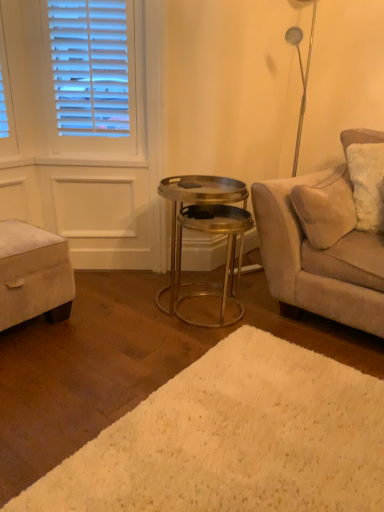
Describe the element at coordinates (32, 272) in the screenshot. I see `velvet beige ottoman at lower left` at that location.

Find the location of `suede beige couch at right`. suede beige couch at right is located at coordinates (319, 250).

What is the approximate height of white shag rug at lower center?

white shag rug at lower center is 1.61 inches tall.

Locate an element on the screen. The image size is (384, 512). velvet beige ottoman at lower left is located at coordinates (32, 272).

From a real-world perspective, relative to metallic/golden table at center, is white shag rug at lower center vertically above or below?

In terms of real-world spatial position, white shag rug at lower center is below metallic/golden table at center.

Which of these two, white shag rug at lower center or metallic/golden table at center, is smaller?

Smaller between the two is white shag rug at lower center.

Who is taller, white shag rug at lower center or metallic/golden table at center?

metallic/golden table at center.

Is white shag rug at lower center positioned with its back to metallic/golden table at center?

white shag rug at lower center is not turned away from metallic/golden table at center.

Is white shag rug at lower center at the right side of suede beige couch at right?

In fact, white shag rug at lower center is to the left of suede beige couch at right.

The width and height of the screenshot is (384, 512). I want to click on studio couch lying above the white shag rug at lower center (from the image's perspective), so click(x=319, y=250).

What's the angular difference between white shag rug at lower center and suede beige couch at right's facing directions?

179 degrees separate the facing orientations of white shag rug at lower center and suede beige couch at right.

Looking at the image, does white shag rug at lower center seem bigger or smaller compared to suede beige couch at right?

In the image, white shag rug at lower center appears to be smaller than suede beige couch at right.

Is metallic/golden table at center beside white shag rug at lower center?

metallic/golden table at center and white shag rug at lower center are not in contact.

Who is smaller, metallic/golden table at center or white shag rug at lower center?

white shag rug at lower center.

From the image's perspective, would you say metallic/golden table at center is shown under white shag rug at lower center?

No, from the image's perspective, metallic/golden table at center is not below white shag rug at lower center.

Could you tell me if metallic/golden table at center is facing white shag rug at lower center?

No, metallic/golden table at center does not turn towards white shag rug at lower center.

Is metallic/golden table at center not close to suede beige couch at right?

No, metallic/golden table at center is not far from suede beige couch at right.

Is metallic/golden table at center taller or shorter than suede beige couch at right?

metallic/golden table at center is shorter than suede beige couch at right.

Considering the relative positions of metallic/golden table at center and suede beige couch at right in the image provided, is metallic/golden table at center to the right of suede beige couch at right from the viewer's perspective?

No, metallic/golden table at center is not to the right of suede beige couch at right.

From a real-world perspective, who is located higher, metallic/golden table at center or suede beige couch at right?

suede beige couch at right is physically above.

You are a GUI agent. You are given a task and a screenshot of the screen. Output one action in this format:
    pyautogui.click(x=<x>, y=<y>)
    Task: Click on the table behind the suede beige couch at right
    
    Given the screenshot: What is the action you would take?
    pyautogui.click(x=206, y=232)

Is suede beige couch at right bigger or smaller than metallic/golden table at center?

suede beige couch at right is bigger than metallic/golden table at center.

Is suede beige couch at right touching metallic/golden table at center?

No, suede beige couch at right is not next to metallic/golden table at center.

Is suede beige couch at right inside or outside of metallic/golden table at center?

suede beige couch at right is not enclosed by metallic/golden table at center.

Is metallic/golden table at center turned away from velvet beige ottoman at lower left?

No, metallic/golden table at center is not facing the opposite direction of velvet beige ottoman at lower left.

From a real-world perspective, who is located higher, metallic/golden table at center or velvet beige ottoman at lower left?

metallic/golden table at center.

Is there a large distance between metallic/golden table at center and velvet beige ottoman at lower left?

They are positioned close to each other.

Does metallic/golden table at center appear on the left side of velvet beige ottoman at lower left?

In fact, metallic/golden table at center is to the right of velvet beige ottoman at lower left.

Looking at this image, between suede beige couch at right and velvet beige ottoman at lower left, which one has smaller width?

With smaller width is velvet beige ottoman at lower left.

From a real-world perspective, between suede beige couch at right and velvet beige ottoman at lower left, who is vertically higher?

From a 3D spatial view, suede beige couch at right is above.

Which of these two, suede beige couch at right or velvet beige ottoman at lower left, stands taller?

suede beige couch at right.

Where is `music stool behind the suede beige couch at right`? This screenshot has height=512, width=384. music stool behind the suede beige couch at right is located at coordinates (32, 272).

Where is `plain below the metallic/golden table at center (from a real-world perspective)`? plain below the metallic/golden table at center (from a real-world perspective) is located at coordinates (234, 439).

In the image, there is a suede beige couch at right. In order to click on plain below it (from the image's perspective) in this screenshot , I will do `click(234, 439)`.

Looking at the image, which one is located closer to metallic/golden table at center, suede beige couch at right or white shag rug at lower center?

suede beige couch at right.

Estimate the real-world distances between objects in this image. Which object is closer to metallic/golden table at center, white shag rug at lower center or velvet beige ottoman at lower left?

velvet beige ottoman at lower left is closer to metallic/golden table at center.

Which object lies further to the anchor point suede beige couch at right, white shag rug at lower center or metallic/golden table at center?

white shag rug at lower center.

Considering their positions, is metallic/golden table at center positioned closer to suede beige couch at right than velvet beige ottoman at lower left?

Among the two, metallic/golden table at center is located nearer to suede beige couch at right.

When comparing their distances from metallic/golden table at center, does white shag rug at lower center or suede beige couch at right seem further?

white shag rug at lower center.

Estimate the real-world distances between objects in this image. Which object is closer to white shag rug at lower center, suede beige couch at right or metallic/golden table at center?

Among the two, suede beige couch at right is located nearer to white shag rug at lower center.

From the image, which object appears to be farther from velvet beige ottoman at lower left, metallic/golden table at center or white shag rug at lower center?

white shag rug at lower center.

Estimate the real-world distances between objects in this image. Which object is closer to metallic/golden table at center, velvet beige ottoman at lower left or suede beige couch at right?

suede beige couch at right is closer to metallic/golden table at center.

Where is `plain between velvet beige ottoman at lower left and suede beige couch at right from left to right`? Image resolution: width=384 pixels, height=512 pixels. plain between velvet beige ottoman at lower left and suede beige couch at right from left to right is located at coordinates (234, 439).

The height and width of the screenshot is (512, 384). I want to click on table between velvet beige ottoman at lower left and white shag rug at lower center in the horizontal direction, so click(206, 232).

The width and height of the screenshot is (384, 512). In order to click on table between velvet beige ottoman at lower left and suede beige couch at right from left to right in this screenshot , I will do `click(206, 232)`.

Where is `studio couch positioned between white shag rug at lower center and metallic/golden table at center from near to far`? This screenshot has height=512, width=384. studio couch positioned between white shag rug at lower center and metallic/golden table at center from near to far is located at coordinates (319, 250).